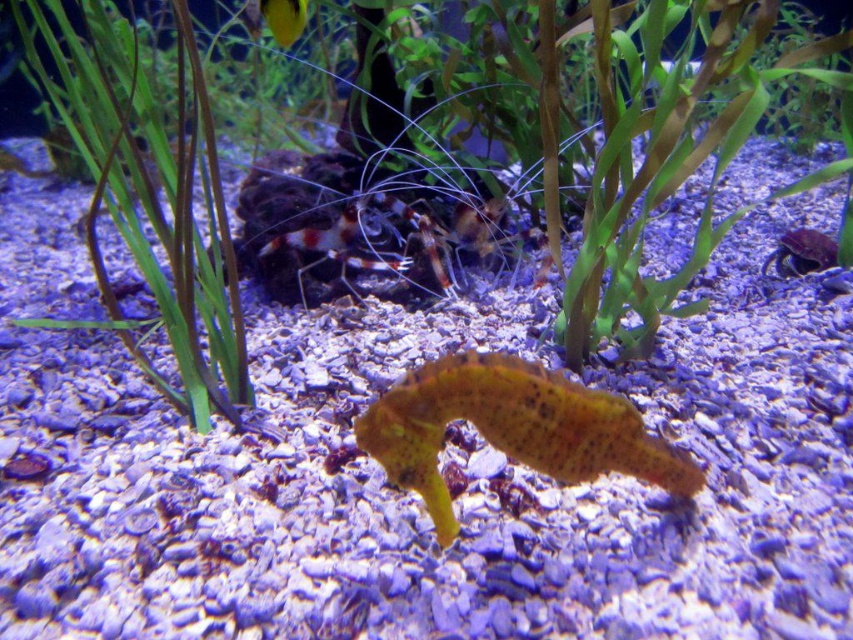
You are an underwater photographer aiming to capture the yellow textured seahorse at center and the green matte plant at left in a single shot. Which object should you position closer to the camera to ensure both are in focus?

To ensure both the yellow textured seahorse at center and the green matte plant at left are in focus, position the green matte plant at left closer to the camera since the seahorse is behind the plant, creating a greater depth of field requirement.

You are a marine biologist observing the underwater scene in the aquarium. You notice the smooth purple crab at right. Can you determine its exact position in the image using the coordinate system provided?

The smooth purple crab at right is located at point (802, 252) in the image coordinate system.